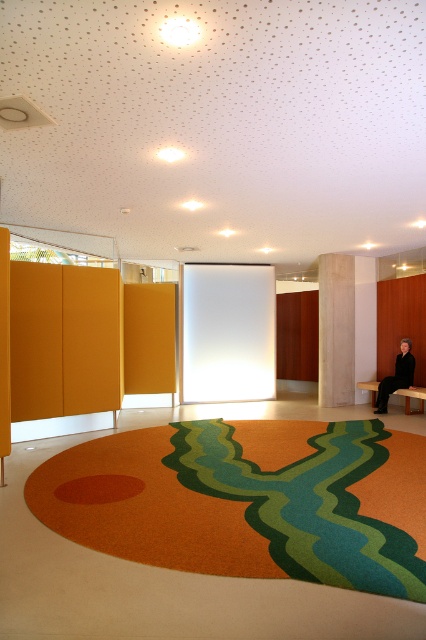
You are sitting on the floor in the foreground of the room and want to move to the exit door located behind the black leather bench at lower right and brown wooden bench at lower right. Which bench should you climb over to reach the door more easily?

The black leather bench at lower right is much taller than the brown wooden bench at lower right, so it would be easier to climb over the brown wooden bench at lower right to reach the door.

You are a person who is 1.8 meters tall. You are standing at the black leather bench at lower right and want to walk towards the light brown wood pillar at right. Is there enough space between you and the pillar to move freely?

The distance between the light brown wood pillar at right and the black leather bench at lower right is 1.11 meters. Since you are 1.8 meters tall, the space is insufficient for comfortable movement as the distance is shorter than your height.

You are standing in the room and see the point at coordinates (307,504). What is the surface material at that point?

The point at coordinates (307,504) is on the carpet at center, so the surface material there is carpet.